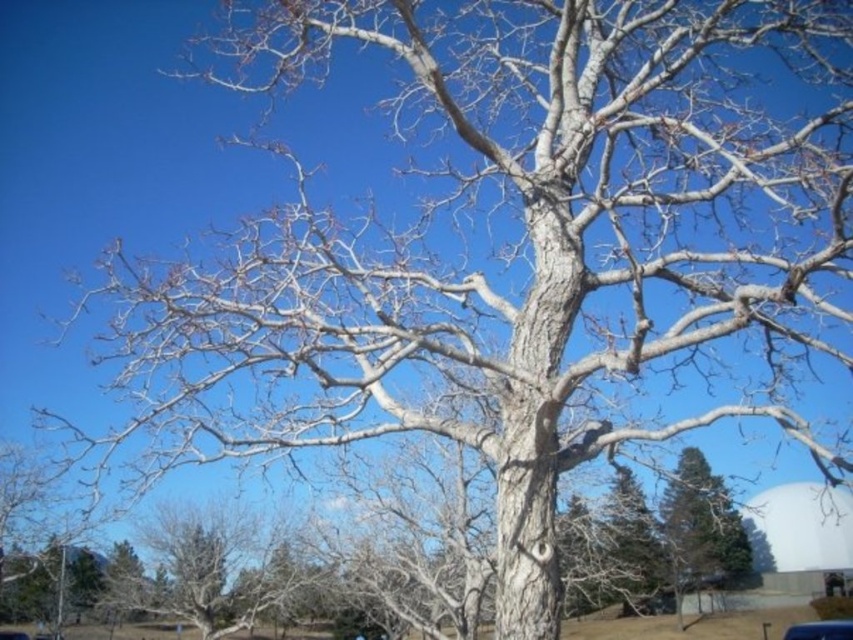
You are standing in a forest and see the smooth bark tree at lower right. If you want to take a photo of it with your camera, which has a maximum focus range of 20 meters, will you be able to capture it clearly?

The smooth bark tree at lower right is 21.96 meters away from camera, which exceeds the maximum focus range of 20 meters. Therefore, the camera cannot capture it clearly.

You are standing in front of the large leafless tree and want to take a photo of the smooth bark tree at lower right without the metallic blue car at center blocking the view. Which direction should you move to ensure the car is out of frame?

To avoid the metallic blue car at center blocking the view of the smooth bark tree at lower right, you should move to the left or right side of the car since the smooth bark tree at lower right is positioned below the car and moving sideways would allow you to frame the tree without the car obstructing it.

Based on the photo, you are a photographer planning to capture the smooth bark tree at lower right and the metallic blue car at center in the same frame. Considering their widths, which object should you position closer to the camera to ensure both fit in the shot?

The smooth bark tree at lower right has a lesser width compared to the metallic blue car at center. To ensure both fit in the shot, position the metallic blue car at center closer to the camera since it is wider and requires more space in the frame.